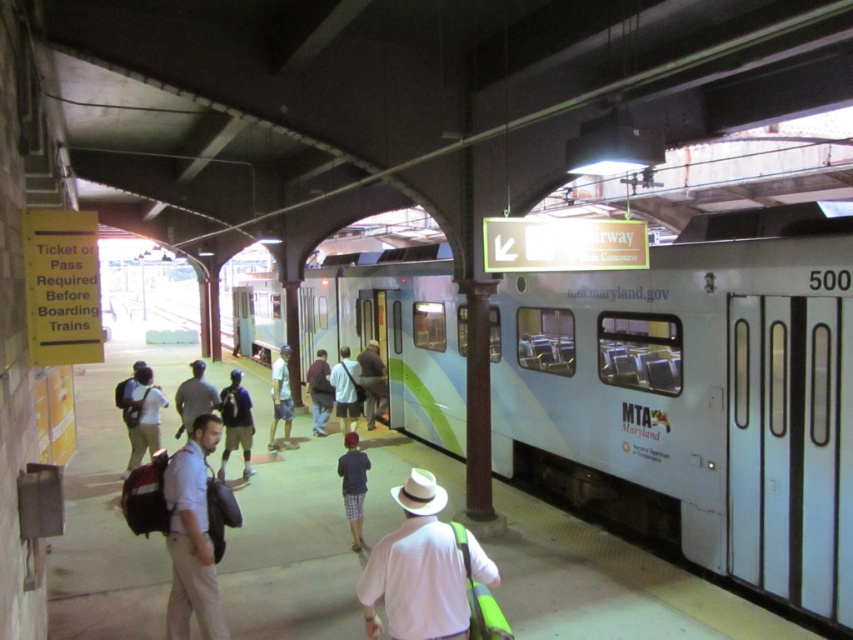
From the picture: You are a person standing on the platform at the train station. You see a dark brown leather jacket at center and a dark brown backpack at center. Which object is taller?

The dark brown leather jacket at center is much taller than the dark brown backpack at center.

You are standing at point (421, 570) on the platform. What is the color of the shirt of the person standing at this point?

The white matte shirt at center is located at point (421, 570), so the color is white.

You are standing on the train station platform and see a person wearing a white matte shirt at center and carrying a dark brown backpack at center. Which item is positioned closer to you?

The white matte shirt at center is closer to the viewer than the dark brown backpack at center.